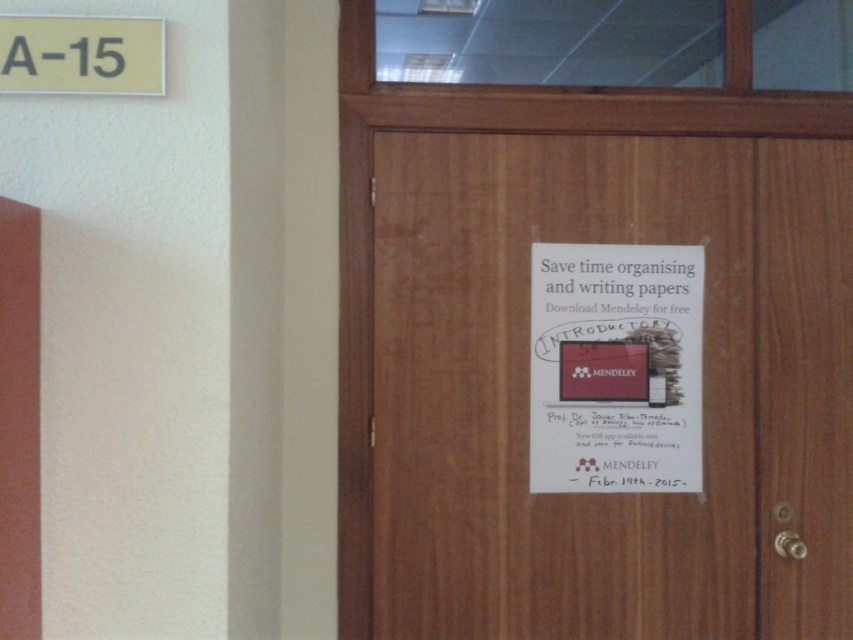
Question: Can you confirm if wooden door at center is wider than yellow plastic sign at upper left?

Choices:
 (A) yes
 (B) no

Answer: (A)

Question: Which point is closer to the camera?

Choices:
 (A) yellow plastic sign at upper left
 (B) wooden door at center
 (C) smooth wood door at left

Answer: (C)

Question: Which is farther from the smooth wood door at left?

Choices:
 (A) wooden door at center
 (B) yellow plastic sign at upper left

Answer: (A)

Question: Does wooden door at center have a larger size compared to smooth wood door at left?

Choices:
 (A) yes
 (B) no

Answer: (A)

Question: Among these points, which one is nearest to the camera?

Choices:
 (A) (13, 273)
 (B) (131, 58)
 (C) (689, 193)

Answer: (A)

Question: Can you confirm if smooth wood door at left is positioned to the left of yellow plastic sign at upper left?

Choices:
 (A) no
 (B) yes

Answer: (B)